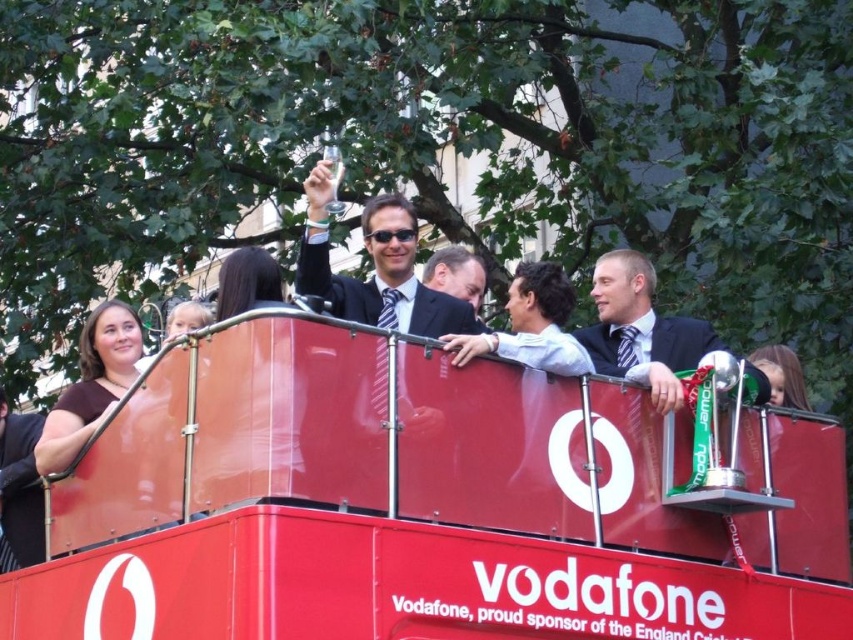
Question: Which point is closer to the camera?

Choices:
 (A) (123, 422)
 (B) (405, 262)
 (C) (477, 276)
 (D) (692, 339)

Answer: (A)

Question: Observing the image, what is the correct spatial positioning of shiny red bus at center in reference to smooth black suit at center?

Choices:
 (A) below
 (B) above

Answer: (A)

Question: Which point is farther from the camera taking this photo?

Choices:
 (A) (375, 240)
 (B) (643, 257)
 (C) (444, 264)

Answer: (C)

Question: Is matte black suit at center positioned in front of matte black suit at right?

Choices:
 (A) yes
 (B) no

Answer: (B)

Question: Which of the following is the farthest from the observer?

Choices:
 (A) smooth black suit at center
 (B) shiny red bus at center
 (C) matte black suit at center
 (D) matte black suit at right

Answer: (A)

Question: Does matte black suit at center have a greater width compared to matte black suit at right?

Choices:
 (A) yes
 (B) no

Answer: (A)